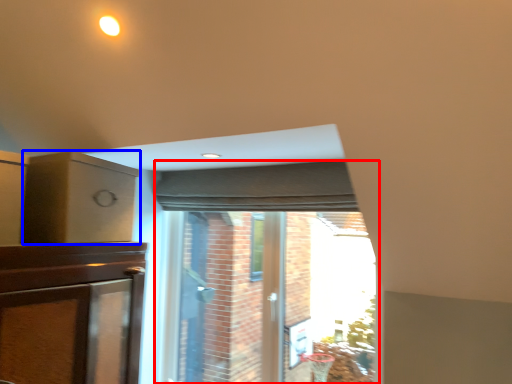
Question: Which object appears farthest to the camera in this image, bay window (highlighted by a red box) or cabinetry (highlighted by a blue box)?

Choices:
 (A) bay window
 (B) cabinetry

Answer: (A)